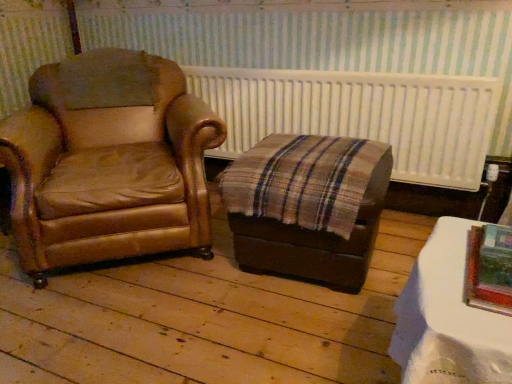
Where is `unoccupied area in front of brown leather chair at left`? The width and height of the screenshot is (512, 384). unoccupied area in front of brown leather chair at left is located at coordinates point(150,329).